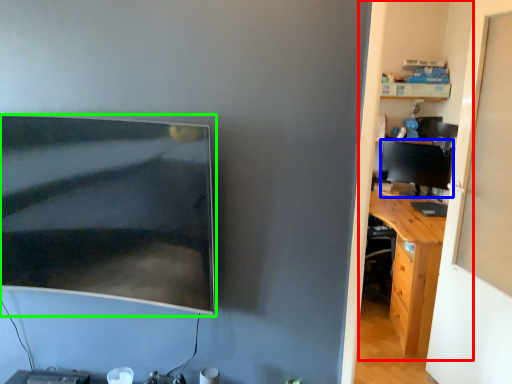
Question: Which object is positioned closest to dresser (highlighted by a red box)? Select from computer monitor (highlighted by a blue box) and computer monitor (highlighted by a green box).

Choices:
 (A) computer monitor
 (B) computer monitor

Answer: (A)